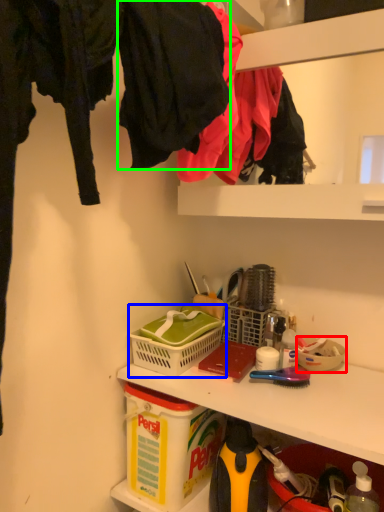
Question: Estimate the real-world distances between objects in this image. Which object is closer to bowl (highlighted by a red box), picnic basket (highlighted by a blue box) or clothing (highlighted by a green box)?

Choices:
 (A) picnic basket
 (B) clothing

Answer: (A)